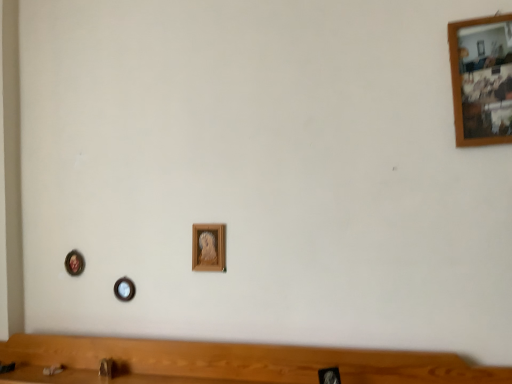
Question: Is metallic circular frame at lower left, the first picture frame positioned from the left, wider than wooden picture frame at center, the 2th picture frame viewed from the left?

Choices:
 (A) no
 (B) yes

Answer: (B)

Question: Considering the relative sizes of metallic circular frame at lower left, the third picture frame when ordered from top to bottom, and wooden picture frame at center, the 4th picture frame from the top, in the image provided, is metallic circular frame at lower left, the third picture frame when ordered from top to bottom, shorter than wooden picture frame at center, the 4th picture frame from the top,?

Choices:
 (A) no
 (B) yes

Answer: (A)

Question: Is metallic circular frame at lower left, which is the fourth picture frame from front to back, bigger than wooden picture frame at center, which is counted as the 1th picture frame, starting from the bottom?

Choices:
 (A) no
 (B) yes

Answer: (B)

Question: Does metallic circular frame at lower left, the third picture frame when ordered from top to bottom, come behind wooden picture frame at center, the 3th picture frame when ordered from front to back?

Choices:
 (A) no
 (B) yes

Answer: (B)

Question: From the image's perspective, does metallic circular frame at lower left, the first picture frame positioned from the left, appear lower than wooden picture frame at center, the 3th picture frame when ordered from front to back?

Choices:
 (A) yes
 (B) no

Answer: (B)

Question: Is wooden picture frame at center, the 3th picture frame when ordered from front to back, taller or shorter than metallic circular frame at lower left, marked as the 2th picture frame in a bottom-to-top arrangement?

Choices:
 (A) short
 (B) tall

Answer: (A)

Question: Considering the relative positions of wooden picture frame at center, which is counted as the 1th picture frame, starting from the bottom, and metallic circular frame at lower left, which appears as the 4th picture frame when viewed from the right, in the image provided, is wooden picture frame at center, which is counted as the 1th picture frame, starting from the bottom, to the left or to the right of metallic circular frame at lower left, which appears as the 4th picture frame when viewed from the right,?

Choices:
 (A) left
 (B) right

Answer: (B)

Question: Does point (122, 279) appear closer or farther from the camera than point (80, 261)?

Choices:
 (A) closer
 (B) farther

Answer: (A)

Question: Looking at their shapes, would you say wooden picture frame at center, the 4th picture frame from the top, is wider or thinner than metallic circular frame at lower left, the third picture frame when ordered from top to bottom?

Choices:
 (A) wide
 (B) thin

Answer: (B)

Question: From a real-world perspective, is wooden picture frame at center, which is counted as the 1th picture frame, starting from the bottom, above or below matte brown faucet at lower center?

Choices:
 (A) above
 (B) below

Answer: (A)

Question: Looking at the image, does wooden picture frame at center, acting as the 2th picture frame starting from the back, seem bigger or smaller compared to matte brown faucet at lower center?

Choices:
 (A) big
 (B) small

Answer: (A)

Question: Visually, is wooden picture frame at center, which is counted as the 1th picture frame, starting from the bottom, positioned to the left or to the right of matte brown faucet at lower center?

Choices:
 (A) left
 (B) right

Answer: (B)

Question: Is point (129, 292) closer or farther from the camera than point (101, 375)?

Choices:
 (A) closer
 (B) farther

Answer: (B)

Question: From the image's perspective, relative to wooden picture frame at upper right, the first picture frame when ordered from top to bottom, is wooden picture frame at center, which is counted as the third picture frame, starting from the back, above or below?

Choices:
 (A) below
 (B) above

Answer: (A)

Question: Considering the positions of wooden picture frame at center, the 3th picture frame viewed from the left, and wooden picture frame at upper right, which appears as the 1th picture frame when viewed from the right, in the image, is wooden picture frame at center, the 3th picture frame viewed from the left, taller or shorter than wooden picture frame at upper right, which appears as the 1th picture frame when viewed from the right,?

Choices:
 (A) short
 (B) tall

Answer: (A)